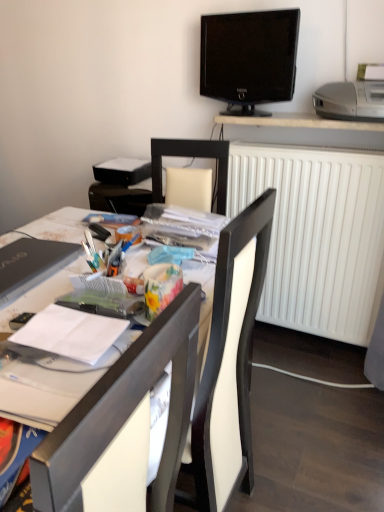
Question: Is black glossy tv at upper center touching white glossy computer desk at center?

Choices:
 (A) no
 (B) yes

Answer: (A)

Question: Is white glossy computer desk at center at the back of black glossy tv at upper center?

Choices:
 (A) yes
 (B) no

Answer: (B)

Question: From the image's perspective, is black glossy tv at upper center over white glossy computer desk at center?

Choices:
 (A) no
 (B) yes

Answer: (B)

Question: Considering the relative positions of black glossy tv at upper center and white glossy computer desk at center in the image provided, is black glossy tv at upper center to the left of white glossy computer desk at center from the viewer's perspective?

Choices:
 (A) yes
 (B) no

Answer: (B)

Question: Can you confirm if black glossy tv at upper center is thinner than white glossy computer desk at center?

Choices:
 (A) no
 (B) yes

Answer: (B)

Question: Can you confirm if black glossy tv at upper center is taller than white glossy computer desk at center?

Choices:
 (A) yes
 (B) no

Answer: (B)

Question: Would you say matte black laptop at left contains silver metallic printer at upper right?

Choices:
 (A) no
 (B) yes

Answer: (A)

Question: Can you confirm if matte black laptop at left is bigger than silver metallic printer at upper right?

Choices:
 (A) yes
 (B) no

Answer: (B)

Question: From a real-world perspective, is matte black laptop at left on top of silver metallic printer at upper right?

Choices:
 (A) no
 (B) yes

Answer: (A)

Question: Considering the relative sizes of matte black laptop at left and silver metallic printer at upper right in the image provided, is matte black laptop at left smaller than silver metallic printer at upper right?

Choices:
 (A) yes
 (B) no

Answer: (A)

Question: Can you confirm if matte black laptop at left is positioned to the left of silver metallic printer at upper right?

Choices:
 (A) no
 (B) yes

Answer: (B)

Question: From the image's perspective, is matte black laptop at left beneath silver metallic printer at upper right?

Choices:
 (A) yes
 (B) no

Answer: (A)

Question: Is matte black laptop at left placed right next to white plastic chair at center?

Choices:
 (A) no
 (B) yes

Answer: (A)